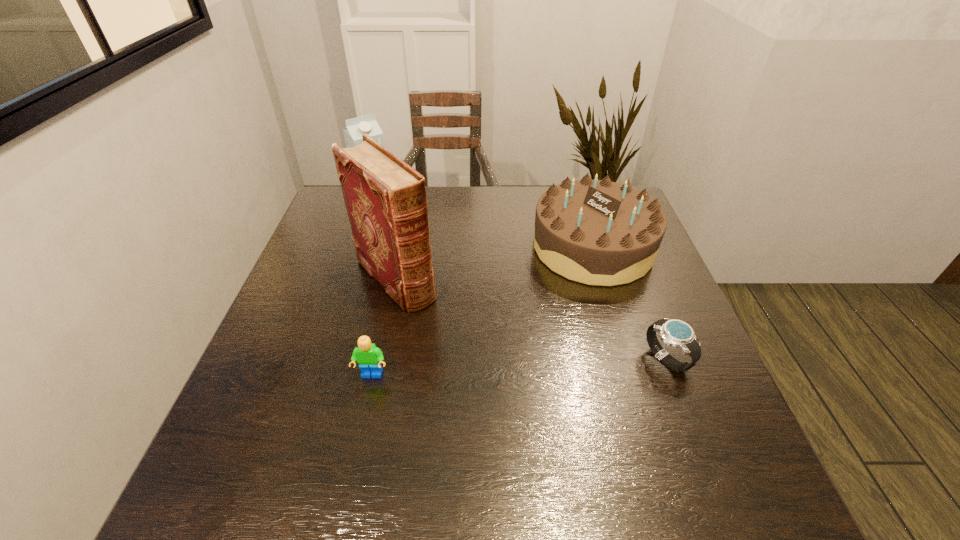
Where is `free space on the desktop that is between the second shortest object and the watch and is positioned on the spine side of the hardback book`? free space on the desktop that is between the second shortest object and the watch and is positioned on the spine side of the hardback book is located at coordinates 483,369.

Where is `free space on the desktop that is between the fourth tallest object and the shortest object and is positioned on the front label of the fourth shortest object`? Image resolution: width=960 pixels, height=540 pixels. free space on the desktop that is between the fourth tallest object and the shortest object and is positioned on the front label of the fourth shortest object is located at coordinates (515, 367).

Locate an element on the screen. The image size is (960, 540). free spot on the desktop that is between the second shortest object and the watch and is positioned on the front-facing side of the third shortest object is located at coordinates (502, 368).